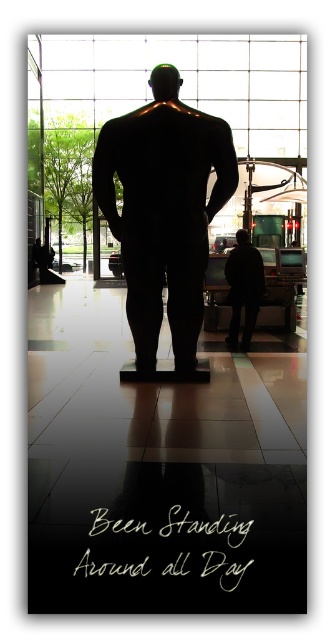
You are standing in the lobby and want to take a photo of the two points mentioned. Which point, point (x=149, y=316) or point (x=260, y=284), will appear larger in your photo?

Point (x=149, y=316) will appear larger in the photo because it is closer to the camera than point (x=260, y=284).

You are an interior designer planning to place a new sculpture in the lobby. The sculpture requires a space that is wider than the black matte mannequin at center and the dark matte figure at center. Based on the scene description, is there enough space between these two objects to accommodate the sculpture?

The black matte mannequin at center might be wider than dark matte figure at center, but since both are positioned at the center, there is no space between them to place the sculpture.